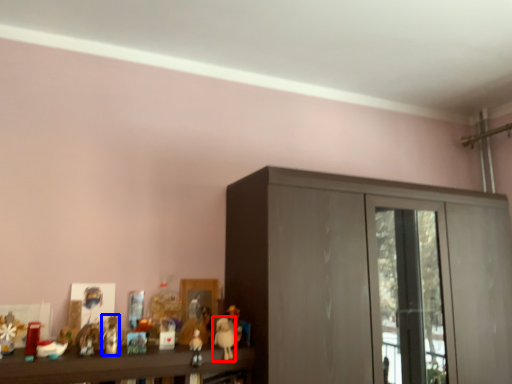
Question: Which object appears closest to the camera in this image, toy (highlighted by a red box) or toy (highlighted by a blue box)?

Choices:
 (A) toy
 (B) toy

Answer: (B)